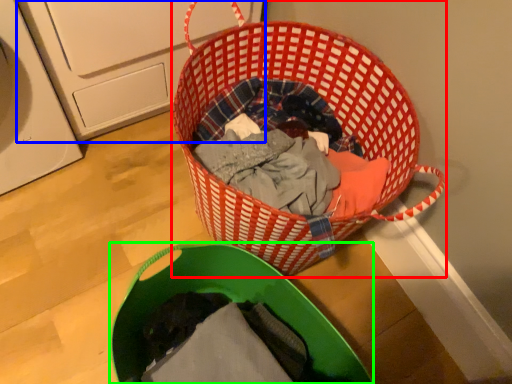
Question: Which is farther away from picnic basket (highlighted by a red box)? washing machine (highlighted by a blue box) or laundry basket (highlighted by a green box)?

Choices:
 (A) washing machine
 (B) laundry basket

Answer: (A)